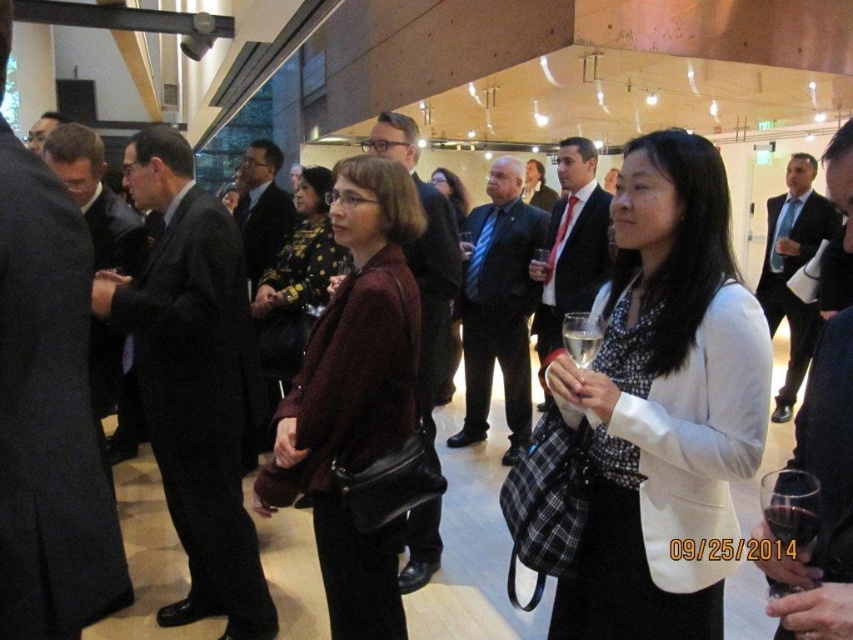
You are at a formal event and want to know which jacket is taller between the maroon woolen jacket at center and the dark brown leather jacket at center. Can you tell me?

The maroon woolen jacket at center is much taller than the dark brown leather jacket at center.